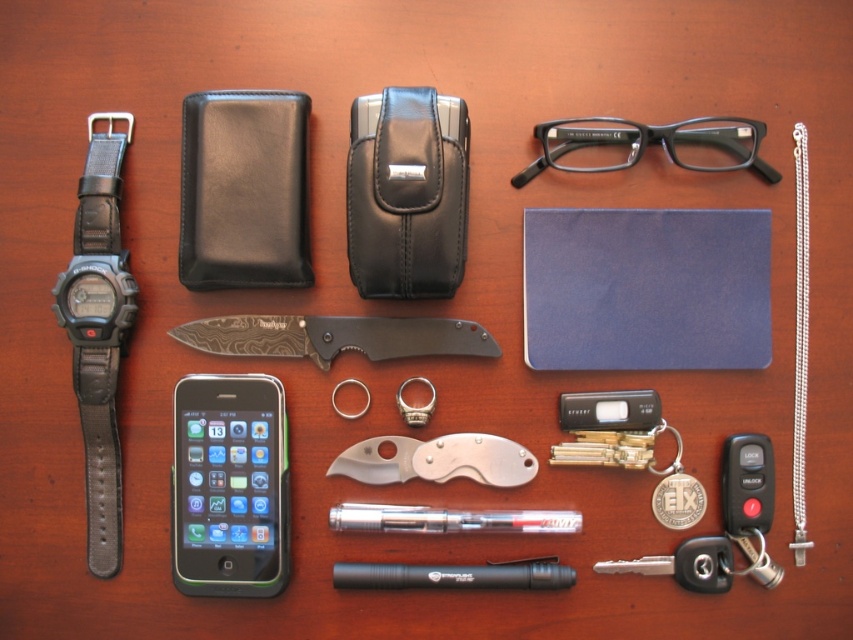
Question: Which point is farther to the camera?

Choices:
 (A) damascus steel knife at center
 (B) black leather watch at left
 (C) silver metallic pocket knife at center

Answer: (C)

Question: Based on their relative distances, which object is nearer to the clear plastic pen at center?

Choices:
 (A) green glossy smartphone at lower left
 (B) silver metallic pocket knife at center
 (C) silver chain necklace at right
 (D) black plastic pen at center

Answer: (D)

Question: Does green glossy smartphone at lower left have a smaller size compared to black leather watch at left?

Choices:
 (A) yes
 (B) no

Answer: (A)

Question: Is black plastic glasses at upper center above silver metallic pocket knife at center?

Choices:
 (A) no
 (B) yes

Answer: (B)

Question: Which point is farther to the camera?

Choices:
 (A) (358, 349)
 (B) (769, 173)

Answer: (A)

Question: Does clear plastic pen at center have a smaller size compared to silver chain necklace at right?

Choices:
 (A) yes
 (B) no

Answer: (B)